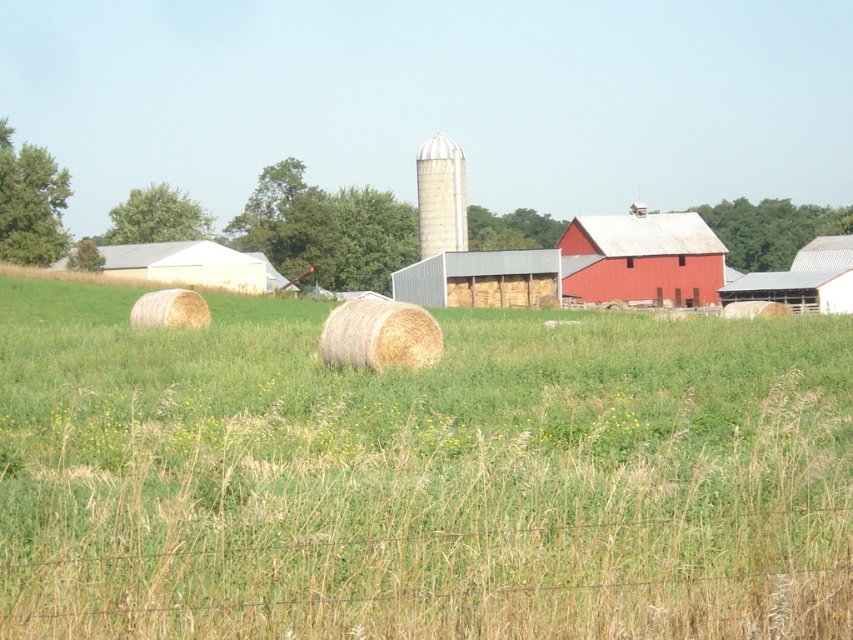
You are standing in the middle of the grassy field with scattered hay bales. You want to walk directly to the red barn at center. Which direction should you head? The coordinates given are in normalized image coordinates where the bottom left corner is the origin. The red barn is located at point (641, 259). The current position is at the center of the field. What direction should you head?

The point (641, 259) indicates the matte red barn at center. Since the coordinates are normalized with the bottom left as the origin, the x coordinate 0.405 is to the left of the center of the image, and the y coordinate 0.753 is above the bottom edge. Therefore, to reach the matte red barn at center from the center of the field, you should head slightly to the left and upwards.

You are a farmer planning to install a new fence between the matte red barn at center and the white matte barn at left. Given their widths, which barn will require a shorter fence section to connect them?

The matte red barn at center has a smaller width than the white matte barn at left, so the fence section needed between them would be shorter for the matte red barn at center.

You are a farmer checking the field layout. You see the matte red barn at center and the light brown straw bale at center. Which object is closer to the wire fence at the bottom of the field?

The light brown straw bale at center is closer to the wire fence at the bottom of the field because the matte red barn at center is positioned over it, meaning the barn is further back.